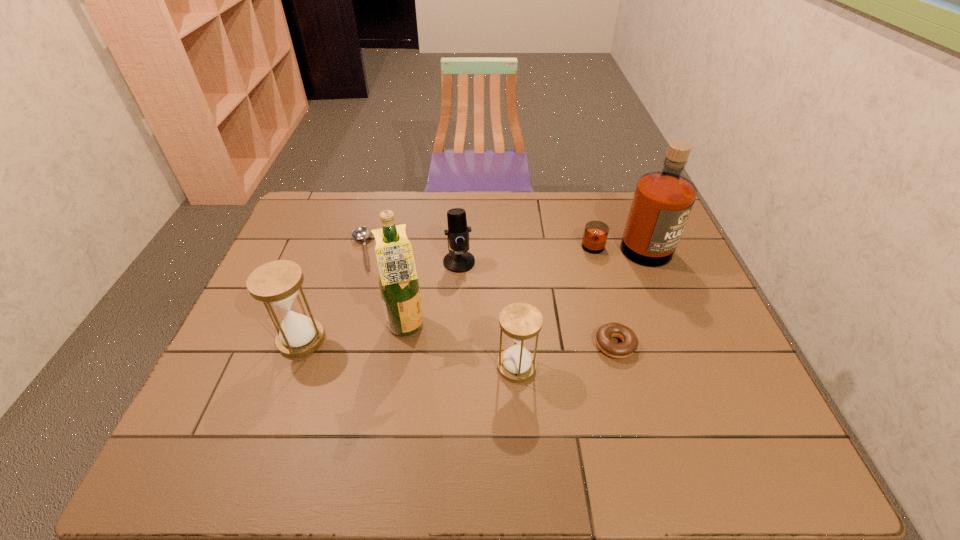
Where is `free space at the far edge of the desktop`? This screenshot has height=540, width=960. free space at the far edge of the desktop is located at coordinates (409, 212).

Locate an element on the screen. vacant space at the near edge of the desktop is located at coordinates (636, 389).

Where is `vacant space at the left edge of the desktop`? This screenshot has height=540, width=960. vacant space at the left edge of the desktop is located at coordinates (276, 385).

In the image, there is a desktop. At what (x,y) coordinates should I click in order to perform the action: click on vacant space at the right edge. Please return your answer as a coordinate pair (x, y). Image resolution: width=960 pixels, height=540 pixels. Looking at the image, I should click on (710, 342).

In the image, there is a desktop. What are the coordinates of `vacant space at the far left corner` in the screenshot? It's located at (321, 193).

This screenshot has height=540, width=960. I want to click on vacant region at the far right corner of the desktop, so click(610, 198).

At what (x,y) coordinates should I click in order to perform the action: click on vacant area that lies between the third object from right to left and the left hourglass. Please return your answer as a coordinate pair (x, y). Image resolution: width=960 pixels, height=540 pixels. Looking at the image, I should click on (409, 353).

Locate an element on the screen. free space between the nearer liquor and the right liquor is located at coordinates (517, 289).

Locate an element on the screen. free area in between the left hourglass and the doughnut is located at coordinates (458, 342).

At what (x,y) coordinates should I click in order to perform the action: click on vacant area that lies between the shortest object and the sixth tallest object. Please return your answer as a coordinate pair (x, y). The height and width of the screenshot is (540, 960). Looking at the image, I should click on (489, 298).